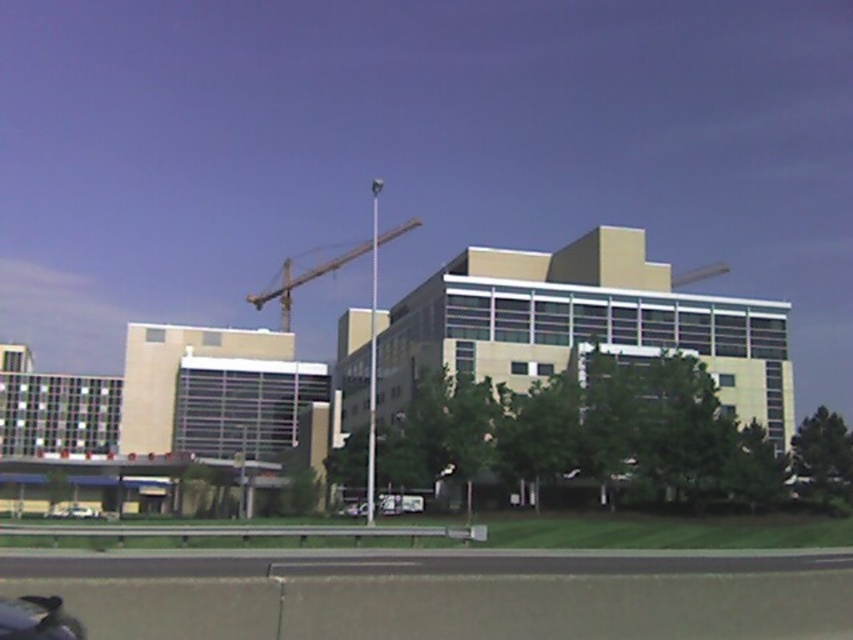
Question: Which object is positioned closest to the black asphalt highway at lower center?

Choices:
 (A) white matte car at lower left
 (B) metallic gray crane at center

Answer: (A)

Question: Considering the real-world distances, which object is farthest from the white matte car at lower left?

Choices:
 (A) black asphalt highway at lower center
 (B) metallic gray crane at center

Answer: (B)

Question: Observing the image, what is the correct spatial positioning of black asphalt highway at lower center in reference to metallic gray crane at center?

Choices:
 (A) below
 (B) above

Answer: (A)

Question: Can you confirm if black asphalt highway at lower center is positioned above metallic gray crane at center?

Choices:
 (A) yes
 (B) no

Answer: (B)

Question: Among these objects, which one is farthest from the camera?

Choices:
 (A) white matte car at lower left
 (B) black asphalt highway at lower center

Answer: (A)

Question: Can you confirm if black asphalt highway at lower center is positioned to the right of white matte car at lower left?

Choices:
 (A) no
 (B) yes

Answer: (B)